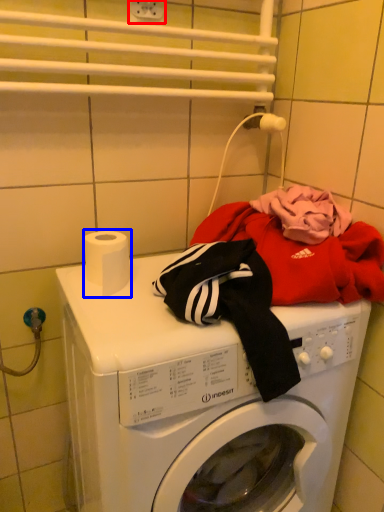
Question: Which of the following is the farthest to the observer, electric outlet (highlighted by a red box) or toilet paper (highlighted by a blue box)?

Choices:
 (A) electric outlet
 (B) toilet paper

Answer: (A)